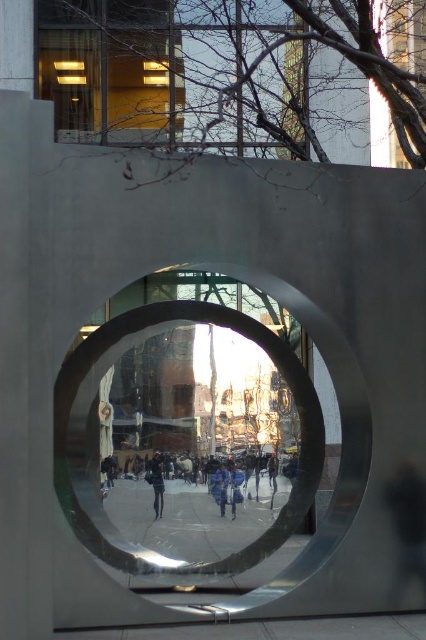
Is point (92, 349) positioned in front of point (152, 465)?

Yes.

Which is more to the left, polished silver circle at center or dark gray fabric at center?

dark gray fabric at center is more to the left.

Between point (310, 433) and point (161, 477), which one is positioned behind?

Point (310, 433)

Identify the location of polished silver circle at center. (91, 428).